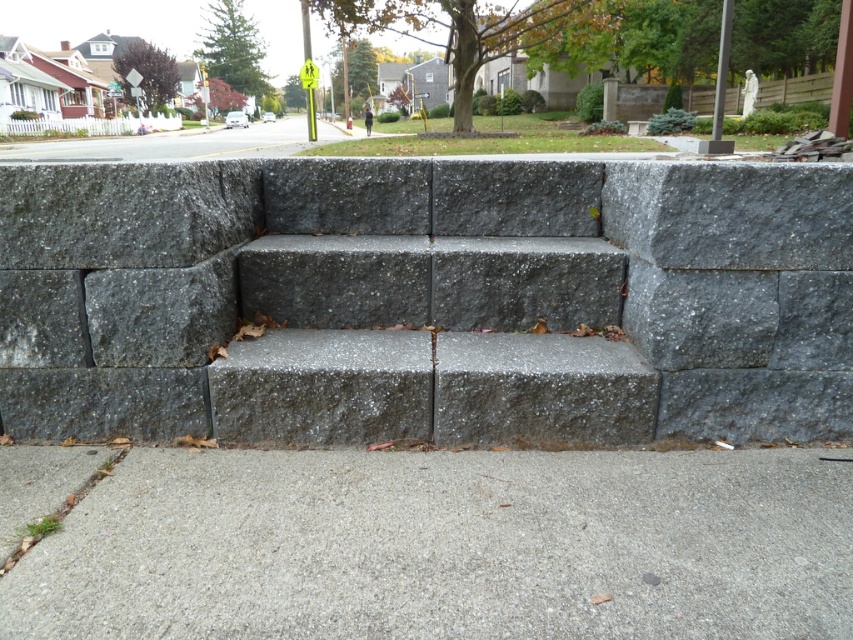
Find the location of a particular element. The height and width of the screenshot is (640, 853). gray concrete stairs at center is located at coordinates (426, 300).

You are a GUI agent. You are given a task and a screenshot of the screen. Output one action in this format:
    pyautogui.click(x=<x>, y=<y>)
    Task: Click on the gray concrete stairs at center
    The width and height of the screenshot is (853, 640).
    Given the screenshot: What is the action you would take?
    pyautogui.click(x=426, y=300)